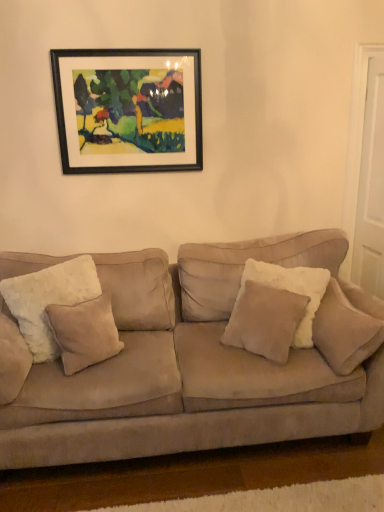
Question: Does beige suede pillow at center, the second pillow when ordered from right to left, come behind white fluffy pillow at left, positioned as the fourth pillow in right-to-left order?

Choices:
 (A) no
 (B) yes

Answer: (B)

Question: Is beige suede pillow at center, which is the 3th pillow from left to right, turned away from white fluffy pillow at left, positioned as the fourth pillow in right-to-left order?

Choices:
 (A) yes
 (B) no

Answer: (B)

Question: From a real-world perspective, is beige suede pillow at center, which is the 3th pillow from left to right, located beneath white fluffy pillow at left, placed as the 1th pillow when sorted from left to right?

Choices:
 (A) yes
 (B) no

Answer: (A)

Question: Can we say beige suede pillow at center, which is the 3th pillow from left to right, lies outside white fluffy pillow at left, placed as the 1th pillow when sorted from left to right?

Choices:
 (A) yes
 (B) no

Answer: (A)

Question: Can you confirm if beige suede pillow at center, the second pillow when ordered from right to left, is shorter than white fluffy pillow at left, placed as the 1th pillow when sorted from left to right?

Choices:
 (A) no
 (B) yes

Answer: (B)

Question: Is white fluffy pillow at left, placed as the 1th pillow when sorted from left to right, inside or outside of beige suede pillow at center, the second pillow when ordered from right to left?

Choices:
 (A) inside
 (B) outside

Answer: (B)

Question: From the image's perspective, relative to beige suede pillow at center, the second pillow when ordered from right to left, is white fluffy pillow at left, positioned as the fourth pillow in right-to-left order, above or below?

Choices:
 (A) below
 (B) above

Answer: (B)

Question: Visually, is white fluffy pillow at left, positioned as the fourth pillow in right-to-left order, positioned to the left or to the right of beige suede pillow at center, the second pillow when ordered from right to left?

Choices:
 (A) right
 (B) left

Answer: (B)

Question: Is point (77, 285) positioned closer to the camera than point (254, 302)?

Choices:
 (A) closer
 (B) farther

Answer: (B)

Question: Does point (92, 271) appear closer or farther from the camera than point (79, 152)?

Choices:
 (A) closer
 (B) farther

Answer: (A)

Question: In the image, is white fluffy pillow at left, placed as the 1th pillow when sorted from left to right, on the left side or the right side of black wood picture frame at upper center?

Choices:
 (A) left
 (B) right

Answer: (A)

Question: From a real-world perspective, is white fluffy pillow at left, placed as the 1th pillow when sorted from left to right, positioned above or below black wood picture frame at upper center?

Choices:
 (A) above
 (B) below

Answer: (B)

Question: In the image, is white fluffy pillow at left, placed as the 1th pillow when sorted from left to right, positioned in front of or behind black wood picture frame at upper center?

Choices:
 (A) front
 (B) behind

Answer: (A)

Question: Is white matte door at right situated inside beige suede couch at center or outside?

Choices:
 (A) outside
 (B) inside

Answer: (A)

Question: Considering the positions of white matte door at right and beige suede couch at center in the image, is white matte door at right taller or shorter than beige suede couch at center?

Choices:
 (A) tall
 (B) short

Answer: (A)